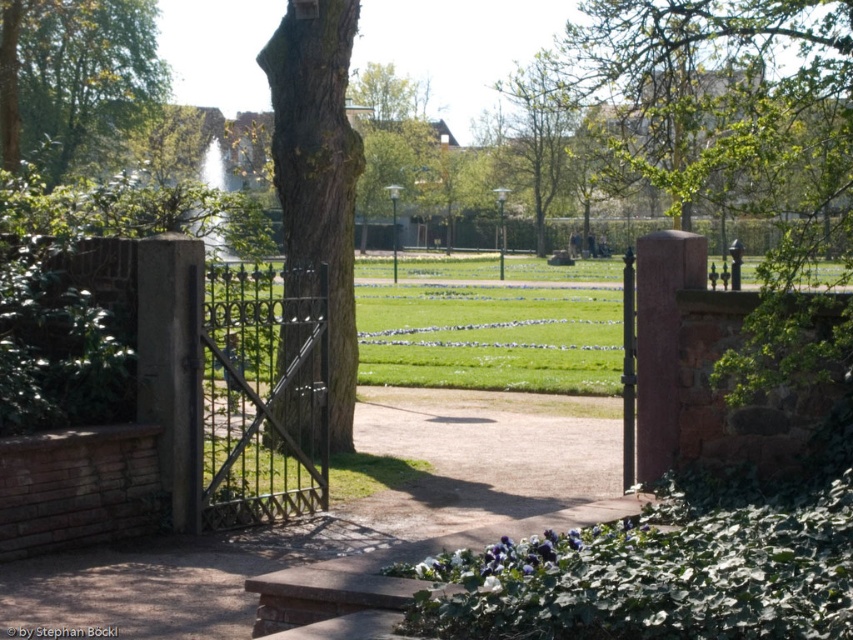
You are a delivery person trying to bring a large 3m wide crate through the dark brown wrought iron gate at center. The green leafy tree at upper center is in the way. Can you pass through the gate without damaging the tree?

The dark brown wrought iron gate at center has a lesser width compared to green leafy tree at upper center. This means the gate is narrower than the tree. Since the crate is 3 meters wide, you need to check if the gate is wide enough. However, the tree being wider than the gate suggests the gate might be too narrow for the crate. Without knowing the exact width of the gate, it is uncertain. But since the tree is wider, and assuming the gate must accommodate the tree somehow, perhaps the tree is positioned

From the picture: You are standing outside the park and see the dark brown wrought iron gate at center and the green leafy tree at upper center. Which object is closer to your left side?

The dark brown wrought iron gate at center is to the left of the green leafy tree at upper center, so it is closer to your left side.